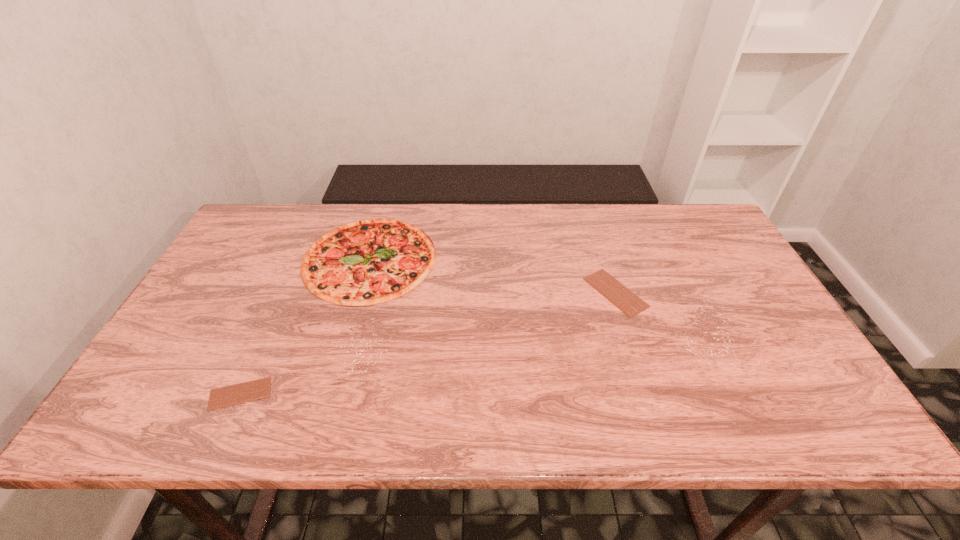
The width and height of the screenshot is (960, 540). Identify the location of the tallest object. (366, 262).

Locate an element on the screen. The image size is (960, 540). the farther chocolate bar is located at coordinates (629, 303).

At what (x,y) coordinates should I click in order to perform the action: click on the right chocolate bar. Please return your answer as a coordinate pair (x, y). Image resolution: width=960 pixels, height=540 pixels. Looking at the image, I should click on (629, 303).

Identify the location of the left chocolate bar. Image resolution: width=960 pixels, height=540 pixels. (226, 396).

Identify the location of the shortest object. (226, 396).

Where is `vacant region located 0.220m on the right of the pizza`? This screenshot has width=960, height=540. vacant region located 0.220m on the right of the pizza is located at coordinates (510, 259).

This screenshot has width=960, height=540. What are the coordinates of `vacant space situated 0.170m on the back of the rightmost object` in the screenshot? It's located at (597, 233).

The image size is (960, 540). I want to click on vacant space located 0.230m on the back of the shortest object, so click(x=281, y=304).

Find the location of a particular element. This screenshot has height=540, width=960. object present at the far edge is located at coordinates (366, 262).

Locate an element on the screen. The image size is (960, 540). object present at the near edge is located at coordinates (226, 396).